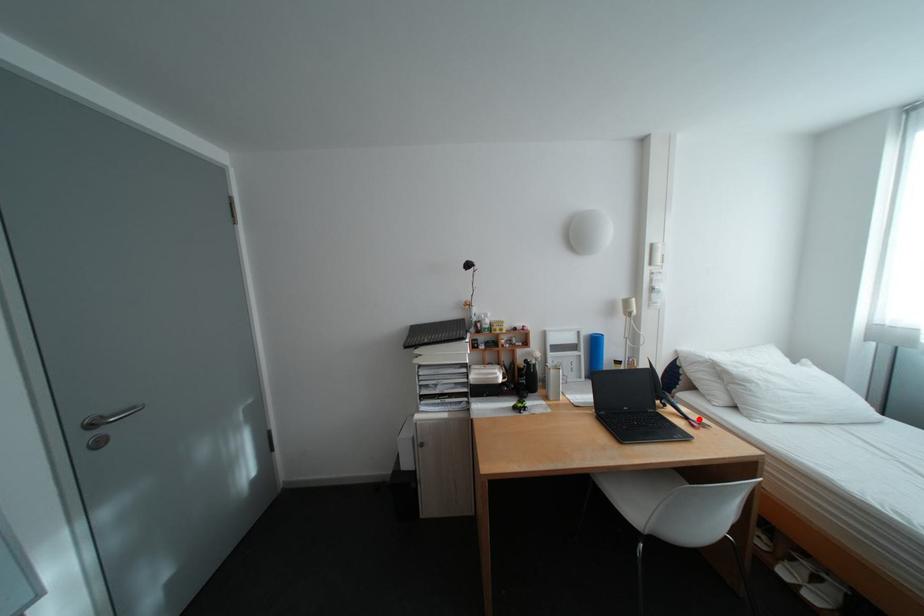
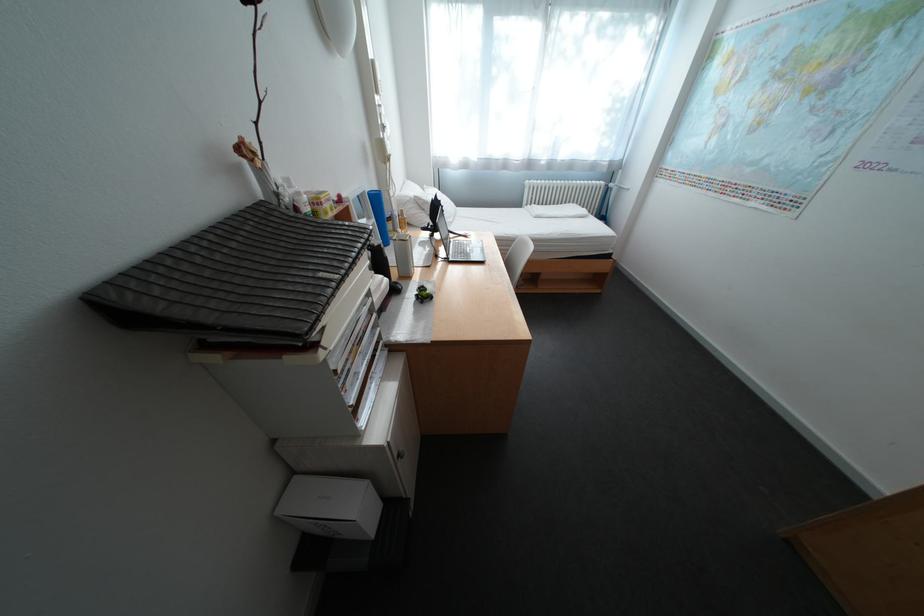
Find the pixel in the second image that matches the highlighted location in the first image.

(472, 236)